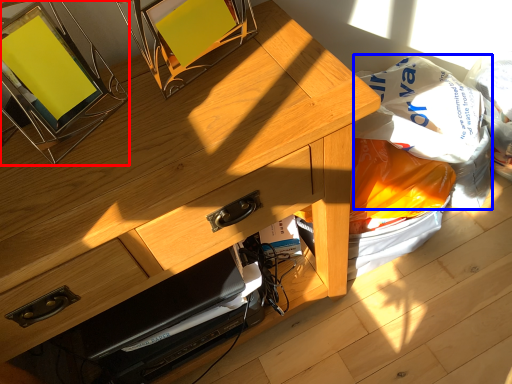
Question: Which of the following is the farthest to the observer, picture frame (highlighted by a red box) or grocery bag (highlighted by a blue box)?

Choices:
 (A) picture frame
 (B) grocery bag

Answer: (B)